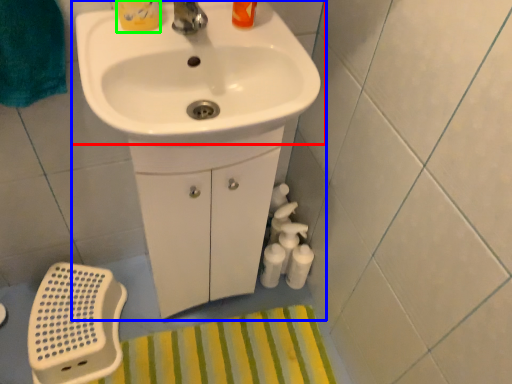
Question: Which object is the farthest from sink (highlighted by a red box)? Choose among these: sink (highlighted by a blue box) or toiletry (highlighted by a green box).

Choices:
 (A) sink
 (B) toiletry

Answer: (B)